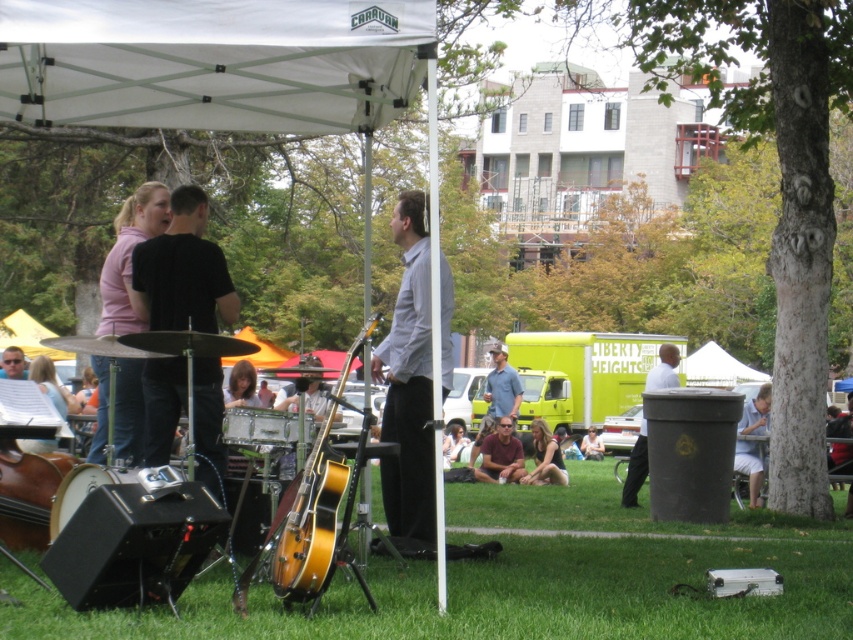
Is point (346, 608) farther from camera compared to point (61, 516)?

No, (346, 608) is closer to viewer.

Is green grass at lower center above metallic silver drum at lower left?

No.

I want to click on green grass at lower center, so click(x=520, y=580).

Where is `green grass at lower center`? green grass at lower center is located at coordinates (520, 580).

Does silver metallic drum at center have a lesser width compared to blonde hair at lower left?

Correct, silver metallic drum at center's width is less than blonde hair at lower left's.

Which of these two, silver metallic drum at center or blonde hair at lower left, stands taller?

blonde hair at lower left is taller.

Between point (271, 428) and point (51, 440), which one is positioned in front?

Point (271, 428)

This screenshot has width=853, height=640. Find the location of `silver metallic drum at center`. silver metallic drum at center is located at coordinates point(264,426).

Which of these two, light gray shirt at center or glossy wood guitar at center, stands shorter?

Standing shorter between the two is glossy wood guitar at center.

Is light gray shirt at center below glossy wood guitar at center?

No.

What do you see at coordinates (408, 381) in the screenshot?
I see `light gray shirt at center` at bounding box center [408, 381].

I want to click on light gray shirt at center, so click(x=408, y=381).